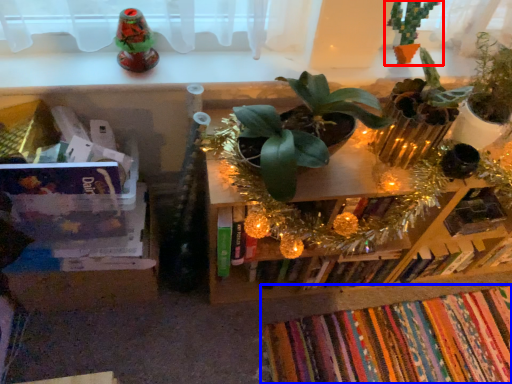
Question: Which object appears farthest to the camera in this image, houseplant (highlighted by a red box) or book (highlighted by a blue box)?

Choices:
 (A) houseplant
 (B) book

Answer: (B)